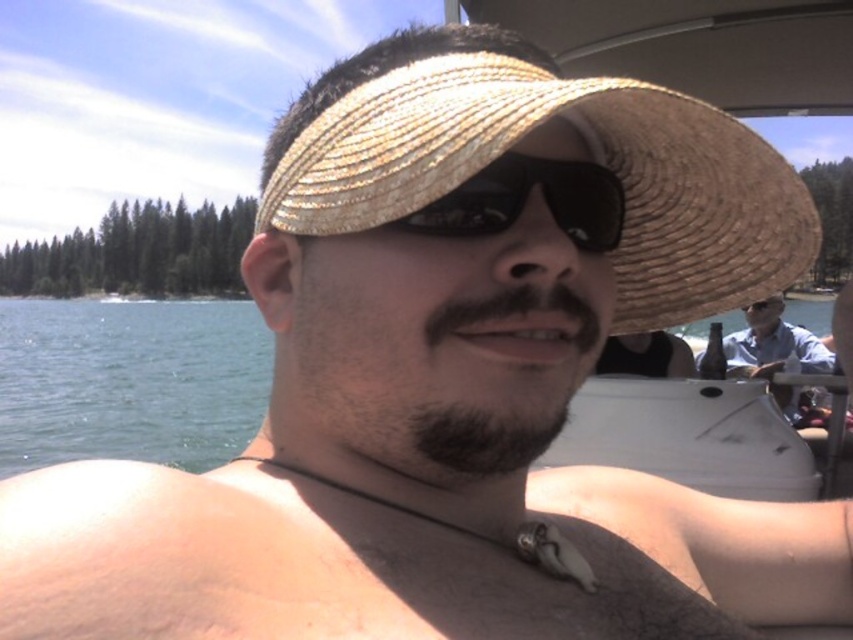
Can you confirm if natural straw hat at center is shorter than black reflective sunglasses at center?

Incorrect, natural straw hat at center's height does not fall short of black reflective sunglasses at center's.

The width and height of the screenshot is (853, 640). I want to click on natural straw hat at center, so click(518, 140).

Between black reflective sunglasses at center and straw hat at center, which one has less height?

straw hat at center

Is black reflective sunglasses at center taller than straw hat at center?

Yes, black reflective sunglasses at center is taller than straw hat at center.

Describe the element at coordinates (525, 198) in the screenshot. This screenshot has width=853, height=640. I see `black reflective sunglasses at center` at that location.

The width and height of the screenshot is (853, 640). What are the coordinates of `black reflective sunglasses at center` in the screenshot? It's located at (525, 198).

Based on the photo, is green water at lower left wider than straw hat at center?

Correct, the width of green water at lower left exceeds that of straw hat at center.

Which is in front, point (16, 429) or point (755, 310)?

Point (755, 310) is in front.

Locate an element on the screen. Image resolution: width=853 pixels, height=640 pixels. green water at lower left is located at coordinates (x=129, y=380).